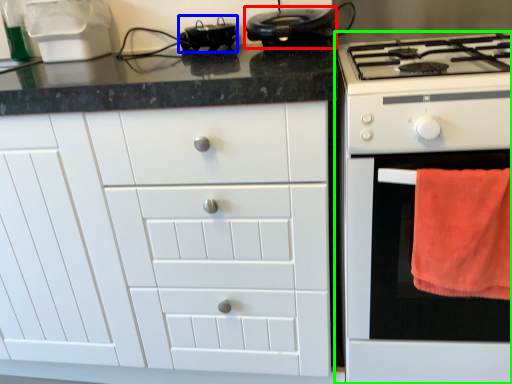
Question: Which is farther away from kitchen appliance (highlighted by a red box)? appliance (highlighted by a blue box) or home appliance (highlighted by a green box)?

Choices:
 (A) appliance
 (B) home appliance

Answer: (B)